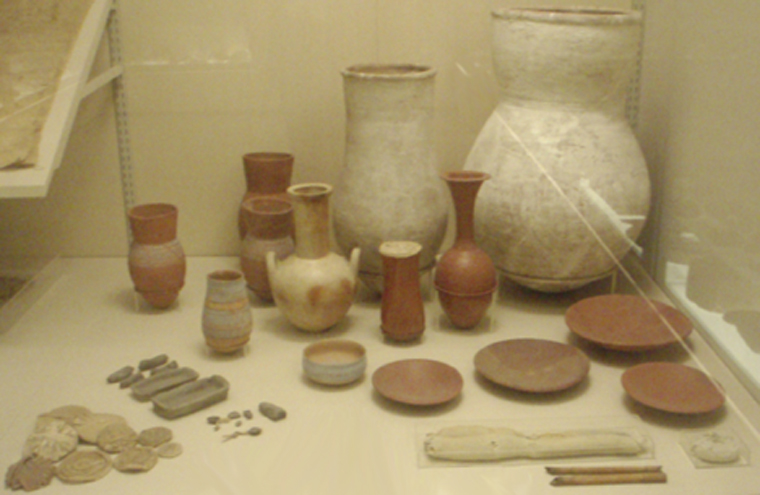
The width and height of the screenshot is (760, 495). Identify the location of dishes. (182, 401), (157, 382).